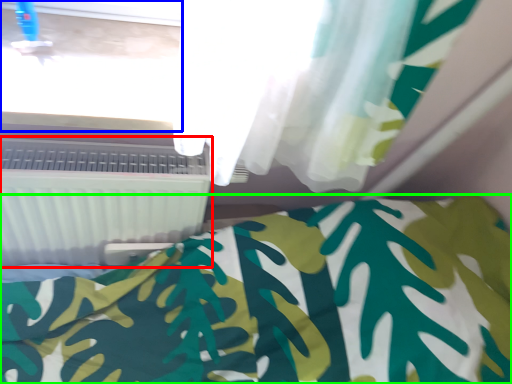
Question: Estimate the real-world distances between objects in this image. Which object is farther from air conditioning (highlighted by a red box), window frame (highlighted by a blue box) or bed (highlighted by a green box)?

Choices:
 (A) window frame
 (B) bed

Answer: (B)